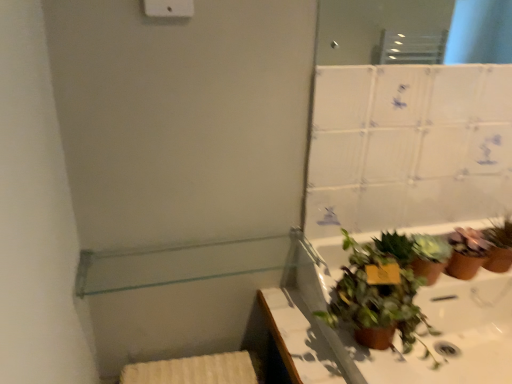
Locate an element on the screen. This screenshot has height=384, width=512. clear glass shelf at upper left is located at coordinates (180, 264).

The image size is (512, 384). What do you see at coordinates (169, 8) in the screenshot?
I see `white plastic light switch at upper center` at bounding box center [169, 8].

Locate an element on the screen. This screenshot has height=384, width=512. green matte plant at lower right, which is the first houseplant from left to right is located at coordinates (429, 256).

Consider the image. Is brown matte pot at right, the second houseplant viewed from the left, turned away from white plastic light switch at upper center?

Answer: That's not correct — brown matte pot at right, the second houseplant viewed from the left, is not looking away from white plastic light switch at upper center.

Between brown matte pot at right, the second houseplant viewed from the left, and white plastic light switch at upper center, which one appears on the right side from the viewer's perspective?

Positioned to the right is brown matte pot at right, the second houseplant viewed from the left.

Is brown matte pot at right, the first houseplant viewed from the right, beside white plastic light switch at upper center?

brown matte pot at right, the first houseplant viewed from the right, and white plastic light switch at upper center are clearly separated.

Does point (448, 236) come closer to viewer compared to point (179, 11)?

No, (448, 236) is behind (179, 11).

Visually, is white plastic light switch at upper center positioned to the left or to the right of brown matte plant pot at lower right?

white plastic light switch at upper center is to the left of brown matte plant pot at lower right.

Between white plastic light switch at upper center and brown matte plant pot at lower right, which one is positioned behind?

white plastic light switch at upper center is further away from the camera.

Is white plastic light switch at upper center not close to brown matte plant pot at lower right?

Actually, white plastic light switch at upper center and brown matte plant pot at lower right are a little close together.

Which object is thinner, white plastic light switch at upper center or brown matte plant pot at lower right?

Thinner between the two is white plastic light switch at upper center.

From a real-world perspective, is white plastic light switch at upper center positioned over green matte plant at lower right, marked as the 2th houseplant in a right-to-left arrangement, based on gravity?

Correct, in the physical world, white plastic light switch at upper center is higher than green matte plant at lower right, marked as the 2th houseplant in a right-to-left arrangement.

Looking at this image, measure the distance from white plastic light switch at upper center to green matte plant at lower right, which is the first houseplant from left to right.

29.13 inches.

Does white plastic light switch at upper center turn towards green matte plant at lower right, marked as the 2th houseplant in a right-to-left arrangement?

No, white plastic light switch at upper center does not turn towards green matte plant at lower right, marked as the 2th houseplant in a right-to-left arrangement.

Who is bigger, white plastic light switch at upper center or green matte plant at lower right, marked as the 2th houseplant in a right-to-left arrangement?

green matte plant at lower right, marked as the 2th houseplant in a right-to-left arrangement.

From a real-world perspective, is green matte plant at lower right, marked as the 2th houseplant in a right-to-left arrangement, physically above brown matte pot at right, the second houseplant viewed from the left?

No, from a real-world perspective, green matte plant at lower right, marked as the 2th houseplant in a right-to-left arrangement, is not over brown matte pot at right, the second houseplant viewed from the left

Does green matte plant at lower right, which is the first houseplant from left to right, appear on the right side of brown matte pot at right, the second houseplant viewed from the left?

No.

From the image's perspective, is green matte plant at lower right, which is the first houseplant from left to right, under brown matte pot at right, the first houseplant viewed from the right?

Yes, from the image's perspective, green matte plant at lower right, which is the first houseplant from left to right, is beneath brown matte pot at right, the first houseplant viewed from the right.

What's the angular difference between clear glass shelf at upper left and green matte plant at lower right, which is the first houseplant from left to right,'s facing directions?

The angle between the facing direction of clear glass shelf at upper left and the facing direction of green matte plant at lower right, which is the first houseplant from left to right, is 2.95 degrees.

From the image's perspective, is clear glass shelf at upper left on green matte plant at lower right, which is the first houseplant from left to right?

Correct, clear glass shelf at upper left appears higher than green matte plant at lower right, which is the first houseplant from left to right, in the image.

In the image, is clear glass shelf at upper left positioned in front of or behind green matte plant at lower right, which is the first houseplant from left to right?

In the image, clear glass shelf at upper left appears in front of green matte plant at lower right, which is the first houseplant from left to right.

Is clear glass shelf at upper left directly adjacent to green matte plant at lower right, which is the first houseplant from left to right?

No, clear glass shelf at upper left is not making contact with green matte plant at lower right, which is the first houseplant from left to right.

Consider the image. Which of these two, brown matte plant pot at lower right or white plastic light switch at upper center, is bigger?

Bigger between the two is brown matte plant pot at lower right.

Looking at this image, is white plastic light switch at upper center a part of brown matte plant pot at lower right?

No, white plastic light switch at upper center is not a part of brown matte plant pot at lower right.

Is brown matte plant pot at lower right facing towards white plastic light switch at upper center?

No, brown matte plant pot at lower right is not facing towards white plastic light switch at upper center.

How far apart are clear glass shelf at upper left and brown matte pot at right, the second houseplant viewed from the left?

clear glass shelf at upper left is 22.19 inches from brown matte pot at right, the second houseplant viewed from the left.

From the image's perspective, is clear glass shelf at upper left over brown matte pot at right, the first houseplant viewed from the right?

Yes, from the image's perspective, clear glass shelf at upper left is above brown matte pot at right, the first houseplant viewed from the right.

From the picture: Considering their positions, is clear glass shelf at upper left located in front of or behind brown matte pot at right, the first houseplant viewed from the right?

In the image, clear glass shelf at upper left appears in front of brown matte pot at right, the first houseplant viewed from the right.

Is clear glass shelf at upper left at the right side of brown matte pot at right, the second houseplant viewed from the left?

Incorrect, clear glass shelf at upper left is not on the right side of brown matte pot at right, the second houseplant viewed from the left.

The width and height of the screenshot is (512, 384). What are the coordinates of `light switch lying in front of the brown matte pot at right, the first houseplant viewed from the right` in the screenshot? It's located at (169, 8).

Locate an element on the screen. This screenshot has height=384, width=512. bath located on the right of white plastic light switch at upper center is located at coordinates (415, 345).

Looking at the image, which one is located closer to clear glass shelf at upper left, brown matte plant pot at lower right or green matte plant at lower right, which is the first houseplant from left to right?

brown matte plant pot at lower right.

Based on their spatial positions, is green matte plant at lower right, marked as the 2th houseplant in a right-to-left arrangement, or brown matte pot at right, the second houseplant viewed from the left, further from white plastic light switch at upper center?

Based on the image, brown matte pot at right, the second houseplant viewed from the left, appears to be further to white plastic light switch at upper center.

When comparing their distances from green matte plant at lower right, marked as the 2th houseplant in a right-to-left arrangement, does clear glass shelf at upper left or white plastic light switch at upper center seem closer?

clear glass shelf at upper left is positioned closer to the anchor green matte plant at lower right, marked as the 2th houseplant in a right-to-left arrangement.

Estimate the real-world distances between objects in this image. Which object is further from white plastic light switch at upper center, brown matte plant pot at lower right or brown matte pot at right, the second houseplant viewed from the left?

brown matte pot at right, the second houseplant viewed from the left, is further to white plastic light switch at upper center.

From the image, which object appears to be nearer to green matte plant at lower right, marked as the 2th houseplant in a right-to-left arrangement, brown matte pot at right, the first houseplant viewed from the right, or brown matte plant pot at lower right?

brown matte pot at right, the first houseplant viewed from the right, is closer to green matte plant at lower right, marked as the 2th houseplant in a right-to-left arrangement.

Which object lies further to the anchor point clear glass shelf at upper left, brown matte plant pot at lower right or white plastic light switch at upper center?

white plastic light switch at upper center lies further to clear glass shelf at upper left than the other object.

From the image, which object appears to be farther from brown matte plant pot at lower right, clear glass shelf at upper left or white plastic light switch at upper center?

Based on the image, white plastic light switch at upper center appears to be further to brown matte plant pot at lower right.

Considering their positions, is clear glass shelf at upper left positioned further to white plastic light switch at upper center than brown matte pot at right, the first houseplant viewed from the right?

brown matte pot at right, the first houseplant viewed from the right, lies further to white plastic light switch at upper center than the other object.

The width and height of the screenshot is (512, 384). In order to click on houseplant between white plastic light switch at upper center and brown matte pot at right, the first houseplant viewed from the right, from left to right in this screenshot , I will do `click(429, 256)`.

Where is `balustrade between white plastic light switch at upper center and brown matte pot at right, the first houseplant viewed from the right, in the horizontal direction`? balustrade between white plastic light switch at upper center and brown matte pot at right, the first houseplant viewed from the right, in the horizontal direction is located at coordinates (180, 264).

The height and width of the screenshot is (384, 512). Find the location of `balustrade between white plastic light switch at upper center and green matte plant at lower right, which is the first houseplant from left to right, from left to right`. balustrade between white plastic light switch at upper center and green matte plant at lower right, which is the first houseplant from left to right, from left to right is located at coordinates (180, 264).

Identify the location of balustrade between white plastic light switch at upper center and brown matte plant pot at lower right in the vertical direction. This screenshot has height=384, width=512. (180, 264).